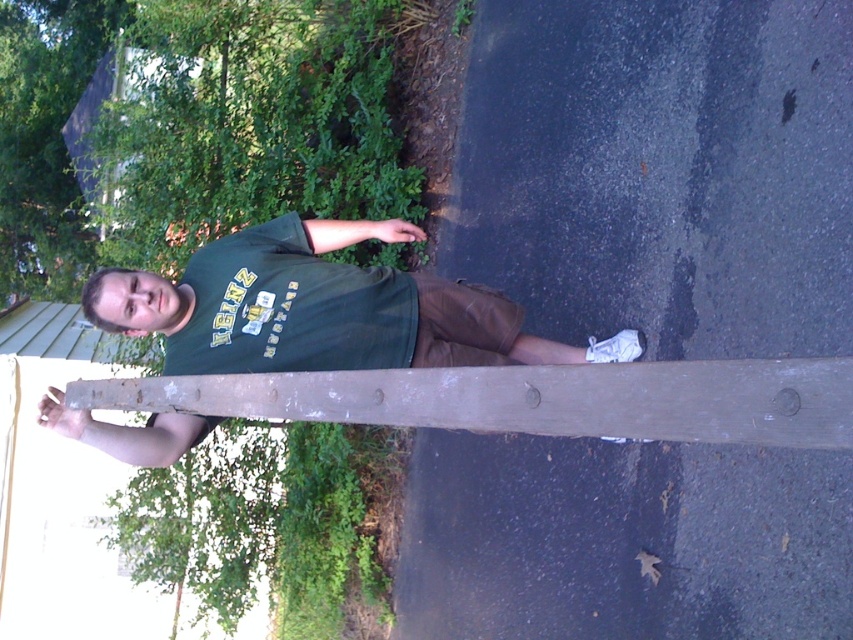
Question: Does green matte shirt at center appear under weathered wood plank at center?

Choices:
 (A) yes
 (B) no

Answer: (B)

Question: Considering the relative positions of green matte shirt at center and weathered wood plank at center in the image provided, where is green matte shirt at center located with respect to weathered wood plank at center?

Choices:
 (A) below
 (B) above

Answer: (B)

Question: Which point is farther to the camera?

Choices:
 (A) (158, 330)
 (B) (486, 404)

Answer: (A)

Question: Is green matte shirt at center smaller than weathered wood plank at center?

Choices:
 (A) no
 (B) yes

Answer: (A)